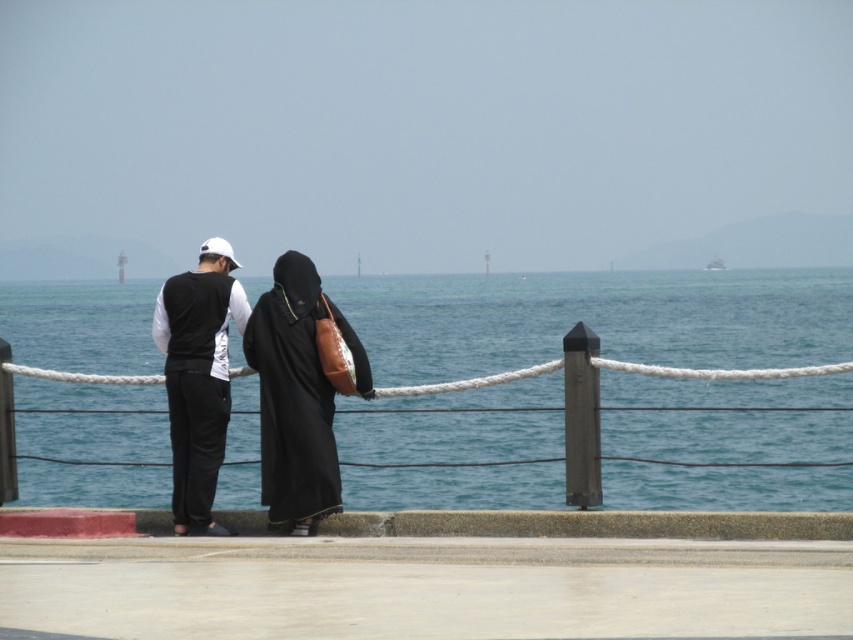
Who is positioned more to the right, black matte dress at center or black matte vest at center?

Positioned to the right is black matte dress at center.

Which of these two, black matte dress at center or black matte vest at center, stands shorter?

Standing shorter between the two is black matte dress at center.

Does point (194, 502) come behind point (189, 440)?

No, (194, 502) is in front of (189, 440).

The height and width of the screenshot is (640, 853). I want to click on black matte dress at center, so click(x=227, y=378).

Between blue water at center and black matte vest at center, which one has more height?

blue water at center

Is blue water at center shorter than black matte vest at center?

Incorrect, blue water at center's height does not fall short of black matte vest at center's.

Identify the location of blue water at center. (596, 320).

Consider the image. Does blue water at center lie behind black matte dress at center?

No, blue water at center is closer to the viewer.

Is blue water at center thinner than black matte dress at center?

No.

Which is in front, point (368, 484) or point (175, 429)?

Point (175, 429)

Locate an element on the screen. Image resolution: width=853 pixels, height=640 pixels. blue water at center is located at coordinates (596, 320).